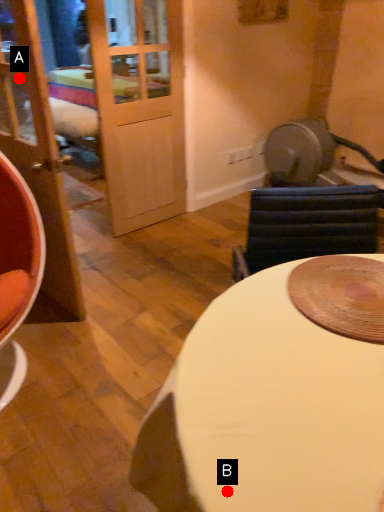
Question: Two points are circled on the image, labeled by A and B beside each circle. Among these points, which one is nearest to the camera?

Choices:
 (A) A is closer
 (B) B is closer

Answer: (B)